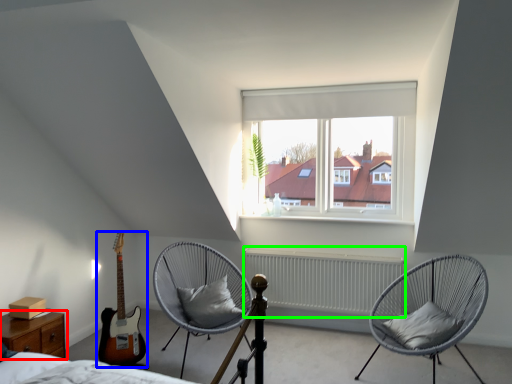
Question: Estimate the real-world distances between objects in this image. Which object is farther from nightstand (highlighted by a red box), guitar (highlighted by a blue box) or radiator (highlighted by a green box)?

Choices:
 (A) guitar
 (B) radiator

Answer: (B)